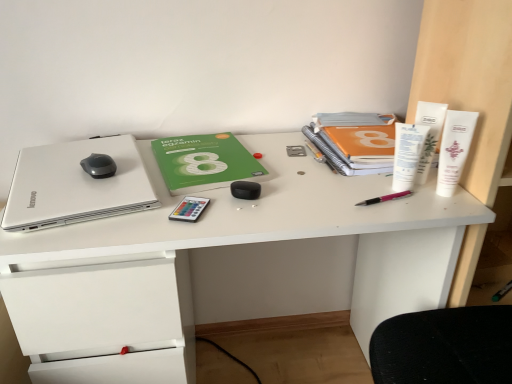
The width and height of the screenshot is (512, 384). Identify the location of vacant space that's between green matte paperback book at center, which is the second paperback book in right-to-left order, and pink metallic pen at center-right, which ranks as the 4th stationery in right-to-left order. (297, 177).